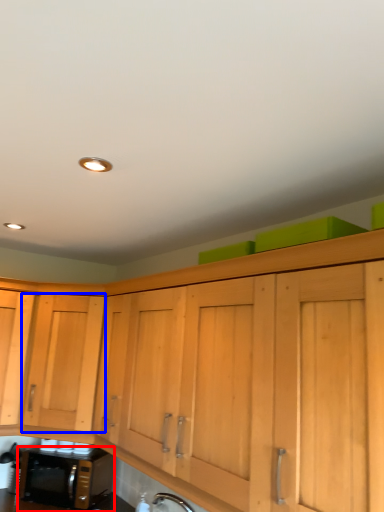
Question: Which point is closer to the camera, microwave oven (highlighted by a red box) or cabinetry (highlighted by a blue box)?

Choices:
 (A) microwave oven
 (B) cabinetry

Answer: (B)